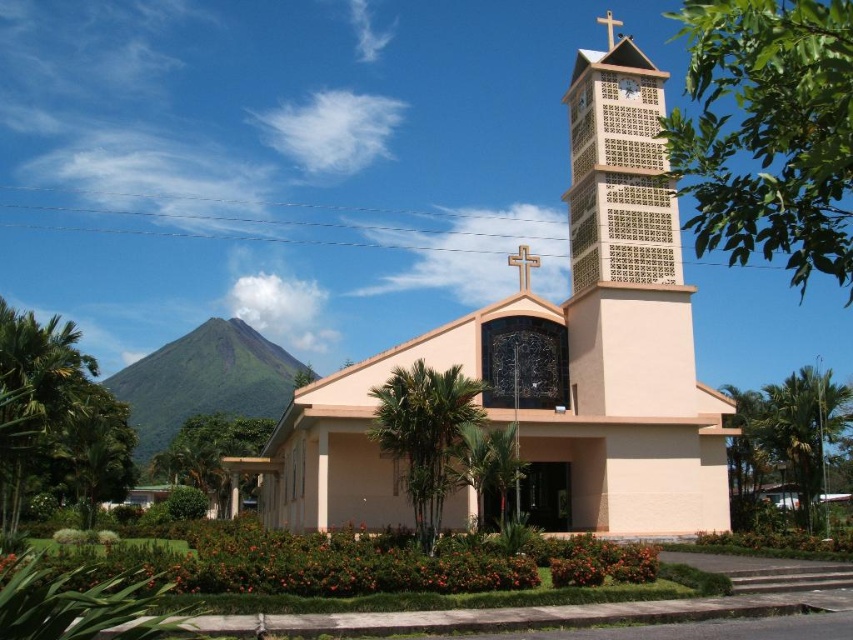
Which of these two, beige lattice clock tower at center or matte beige clock at upper center, stands taller?

beige lattice clock tower at center

Can you confirm if beige lattice clock tower at center is thinner than matte beige clock at upper center?

Incorrect, beige lattice clock tower at center's width is not less than matte beige clock at upper center's.

The height and width of the screenshot is (640, 853). I want to click on beige lattice clock tower at center, so click(x=625, y=237).

Find the location of a particular element. The width and height of the screenshot is (853, 640). beige lattice clock tower at center is located at coordinates (625, 237).

What do you see at coordinates (547, 358) in the screenshot? This screenshot has height=640, width=853. I see `beige concrete church at center` at bounding box center [547, 358].

The width and height of the screenshot is (853, 640). Describe the element at coordinates (547, 358) in the screenshot. I see `beige concrete church at center` at that location.

Locate an element on the screen. beige concrete church at center is located at coordinates (547, 358).

Measure the distance between beige concrete church at center and matte beige clock at upper center.

The distance of beige concrete church at center from matte beige clock at upper center is 26.92 meters.

Is point (534, 444) positioned after point (636, 88)?

No, (534, 444) is closer to viewer.

In order to click on beige concrete church at center in this screenshot , I will do `click(547, 358)`.